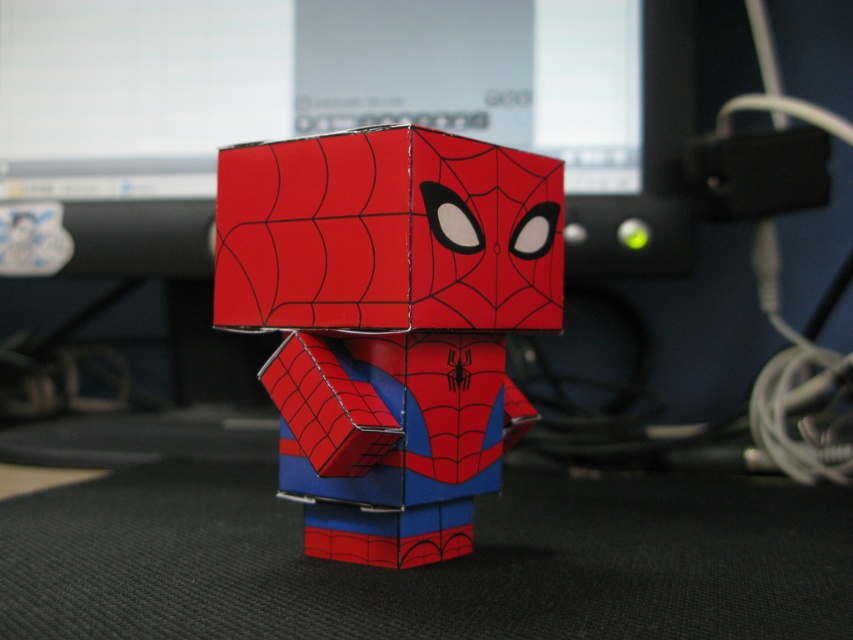
Who is positioned more to the left, matte black monitor at center or cardboard spider-man figure at center?

Positioned to the left is matte black monitor at center.

Does point (178, 44) lie in front of point (303, 340)?

No.

Is point (683, 72) positioned in front of point (467, 280)?

No, it is not.

Where is `matte black monitor at center`? This screenshot has height=640, width=853. matte black monitor at center is located at coordinates (334, 113).